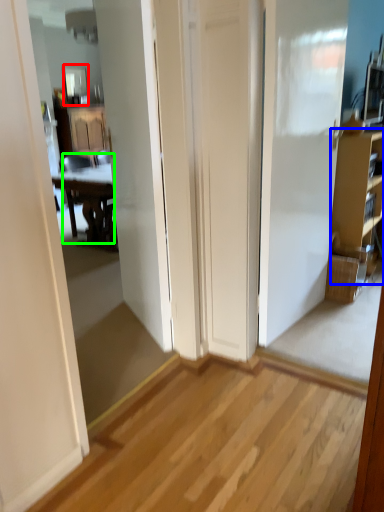
Question: Estimate the real-world distances between objects in this image. Which object is closer to mirror (highlighted by a red box), cabinetry (highlighted by a blue box) or chair (highlighted by a green box)?

Choices:
 (A) cabinetry
 (B) chair

Answer: (B)